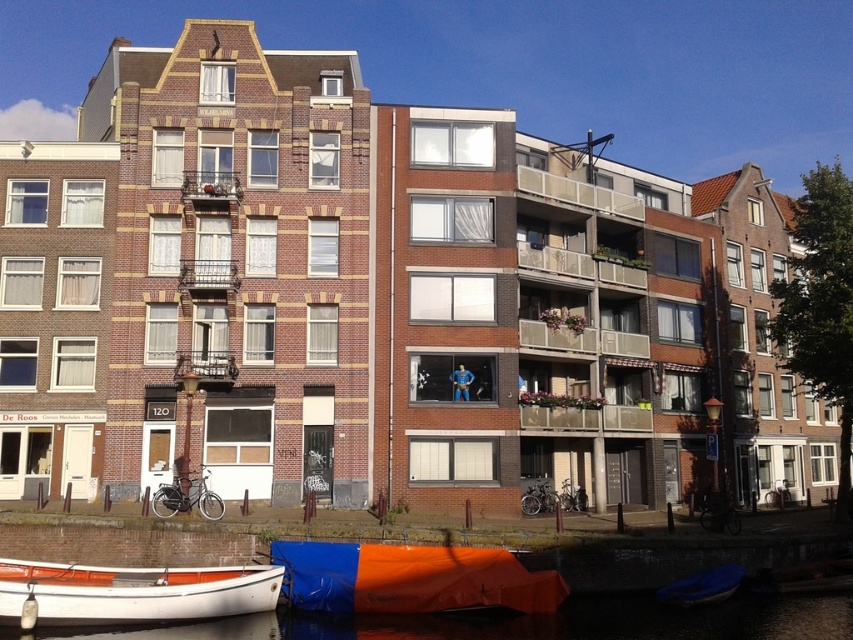
How far apart are orange tarpaulin boat at lower center and matte brick balcony at upper center?

The distance of orange tarpaulin boat at lower center from matte brick balcony at upper center is 20.09 meters.

Image resolution: width=853 pixels, height=640 pixels. What do you see at coordinates (410, 579) in the screenshot?
I see `orange tarpaulin boat at lower center` at bounding box center [410, 579].

Identify the location of orange tarpaulin boat at lower center. (410, 579).

You are a GUI agent. You are given a task and a screenshot of the screen. Output one action in this format:
    pyautogui.click(x=<x>, y=<y>)
    Task: Click on the white glossy boat at lower left
    This screenshot has height=640, width=853.
    Given the screenshot: What is the action you would take?
    pyautogui.click(x=131, y=593)

I want to click on white glossy boat at lower left, so click(131, 593).

Between smooth dark water at lower center and orange tarpaulin boat at lower center, which one is positioned higher?

Positioned higher is orange tarpaulin boat at lower center.

Between smooth dark water at lower center and orange tarpaulin boat at lower center, which one is positioned lower?

smooth dark water at lower center

Is point (108, 627) less distant than point (339, 592)?

That is True.

Identify the location of smooth dark water at lower center. (532, 621).